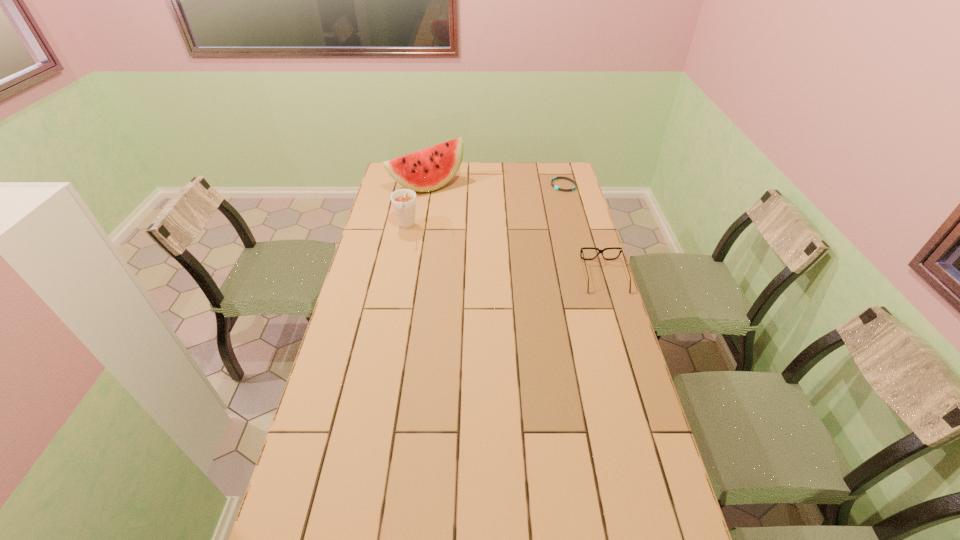
Find the location of a particular element. Image resolution: width=960 pixels, height=540 pixels. object that is at the far right corner is located at coordinates (555, 187).

In the image, there is a desktop. Where is `vacant area at the far edge`? The height and width of the screenshot is (540, 960). vacant area at the far edge is located at coordinates (491, 181).

The image size is (960, 540). What are the coordinates of `free space at the near edge` in the screenshot? It's located at (584, 514).

The width and height of the screenshot is (960, 540). Find the location of `free location at the left edge`. free location at the left edge is located at coordinates (395, 261).

The width and height of the screenshot is (960, 540). Find the location of `vacant space at the right edge of the desktop`. vacant space at the right edge of the desktop is located at coordinates (549, 205).

You are a GUI agent. You are given a task and a screenshot of the screen. Output one action in this format:
    pyautogui.click(x=<x>, y=<y>)
    Task: Click on the free space between the spectacles and the wristband
    The image size is (960, 540).
    Given the screenshot: What is the action you would take?
    pyautogui.click(x=584, y=231)

I want to click on empty space between the watermelon and the second nearest object, so click(417, 206).

This screenshot has height=540, width=960. Identify the location of blank region between the watermelon and the nearest object. (516, 231).

The height and width of the screenshot is (540, 960). Identify the location of vacant area that lies between the watermelon and the nearest object. [x=516, y=231].

Find the location of a particular element. The height and width of the screenshot is (540, 960). vacant space that is in between the nearest object and the root beer is located at coordinates (505, 252).